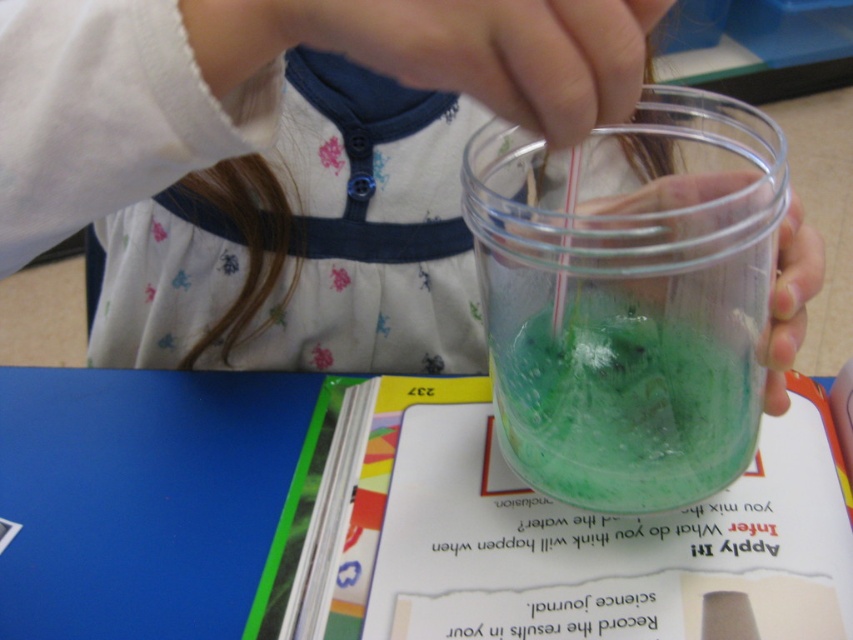
Between translucent plastic cup at center and translucent green liquid at center, which one has more height?

Standing taller between the two is translucent plastic cup at center.

This screenshot has height=640, width=853. Describe the element at coordinates (625, 308) in the screenshot. I see `translucent plastic cup at center` at that location.

The width and height of the screenshot is (853, 640). I want to click on translucent plastic cup at center, so click(x=625, y=308).